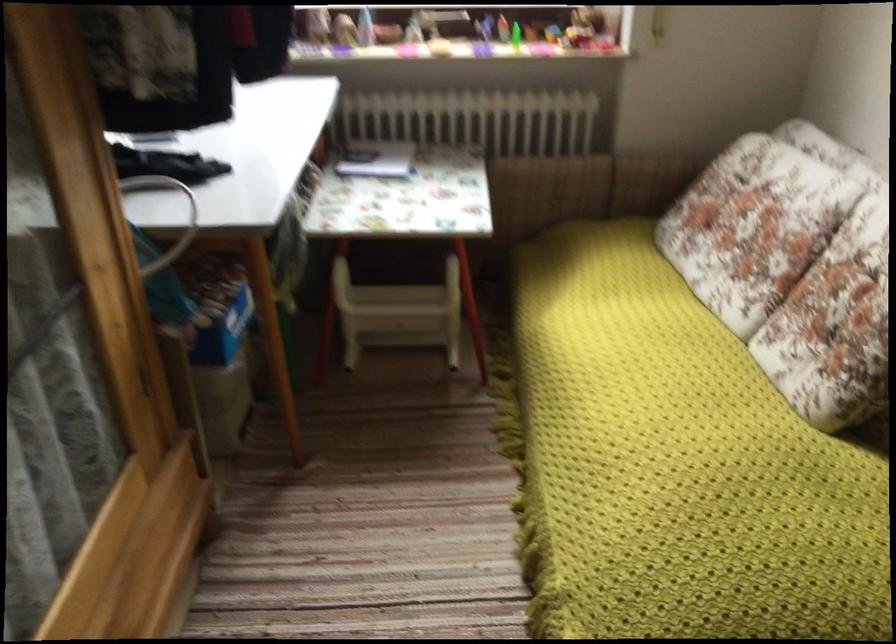
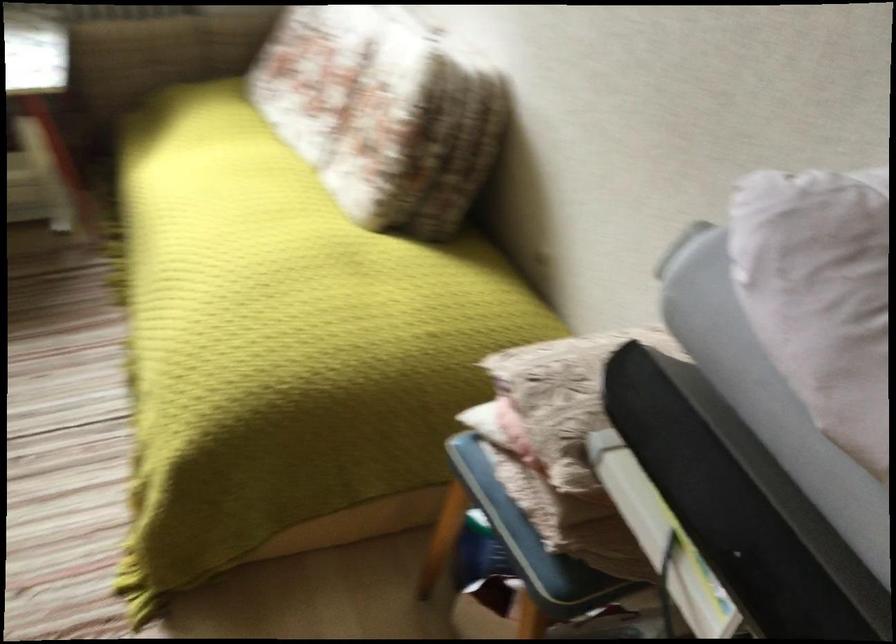
Where in the second image is the point corresponding to (x=760, y=547) from the first image?

(290, 314)